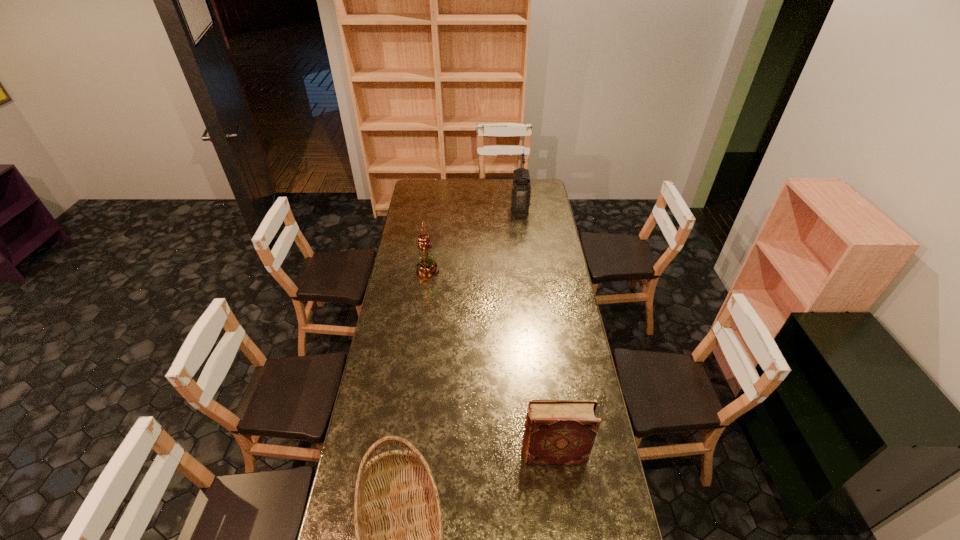
This screenshot has height=540, width=960. In order to click on lantern in this screenshot , I will do `click(520, 187)`.

Locate an element on the screen. This screenshot has height=540, width=960. the third nearest object is located at coordinates [x=427, y=268].

Locate an element on the screen. hardback book is located at coordinates (556, 431).

Locate an element on the screen. This screenshot has width=960, height=540. free space located 0.150m on the front-facing side of the farthest object is located at coordinates click(x=487, y=208).

This screenshot has height=540, width=960. What are the coordinates of `vacant space located 0.360m on the front-facing side of the farthest object` in the screenshot? It's located at (452, 208).

Where is `vacant point located on the front-facing side of the farthest object`? The width and height of the screenshot is (960, 540). vacant point located on the front-facing side of the farthest object is located at coordinates (470, 208).

This screenshot has height=540, width=960. In order to click on free space located 0.320m on the back of the third nearest object in this screenshot , I will do `click(434, 227)`.

You are a GUI agent. You are given a task and a screenshot of the screen. Output one action in this format:
    pyautogui.click(x=<x>, y=<y>)
    Task: Click on the free region located on the spine side of the hardback book
    Image resolution: width=960 pixels, height=540 pixels.
    Given the screenshot: What is the action you would take?
    pyautogui.click(x=504, y=455)

Image resolution: width=960 pixels, height=540 pixels. Identify the location of free location located 0.380m on the spine side of the hardback book. (414, 455).

Identify the location of free region located 0.290m on the spine side of the hardback book. (439, 455).